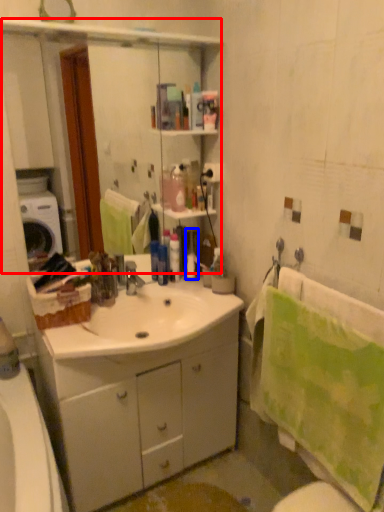
Question: Which point is further to the camera, mirror (highlighted by a red box) or toiletry (highlighted by a blue box)?

Choices:
 (A) mirror
 (B) toiletry

Answer: (B)